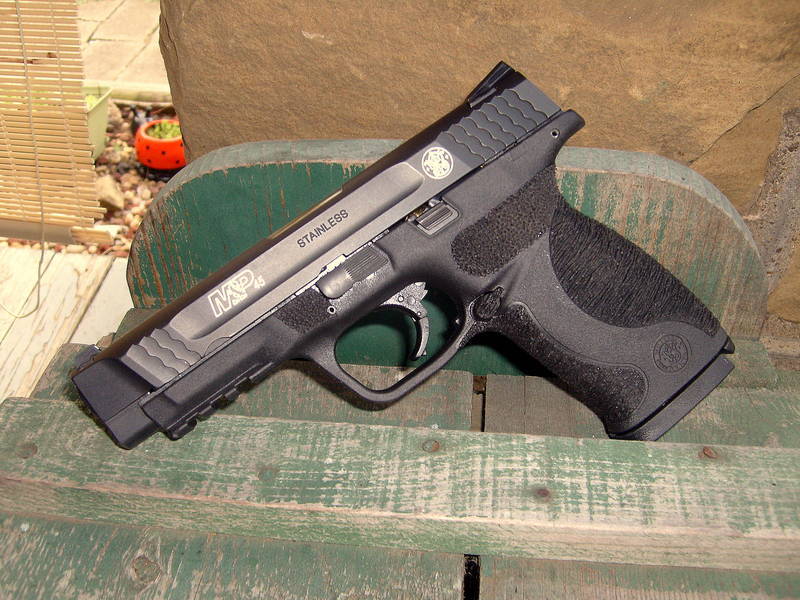
This screenshot has width=800, height=600. In order to click on bamboo shade in this screenshot , I will do `click(30, 128)`.